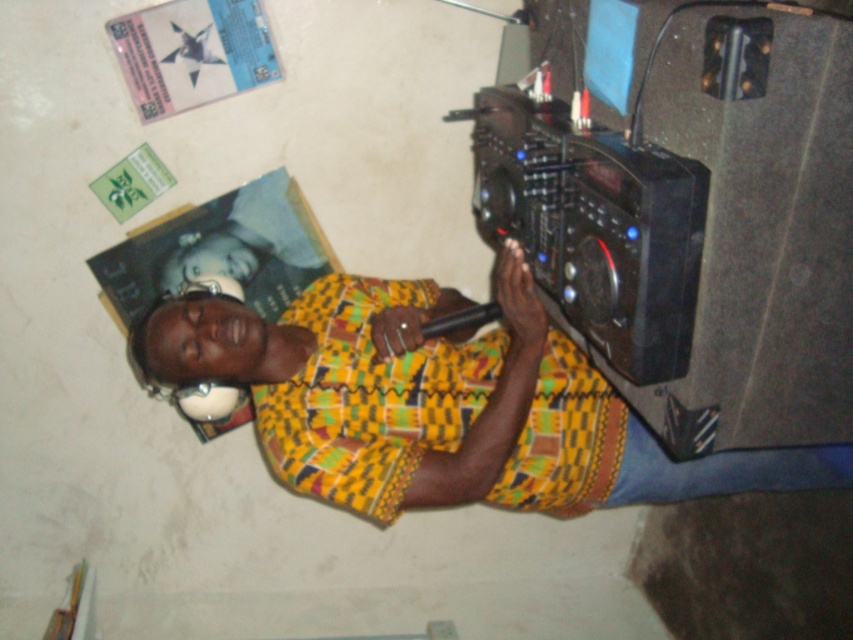
You are setting up a live stream for a music event. You have a black matte speaker at right and a black plastic video camera at right. Which one should you place higher to avoid blocking the camera lens?

You should place the black matte speaker at right higher than the black plastic video camera at right because the speaker has a greater height, so positioning it higher will prevent it from blocking the camera lens.

You are a photographer trying to capture a wide shot of the yellow printed shirt at center and the black plastic video camera at right. Based on their sizes, which object should you focus on to ensure both fit in the frame?

The yellow printed shirt at center might be wider than black plastic video camera at right, so you should focus on the yellow printed shirt at center to ensure both fit in the frame.